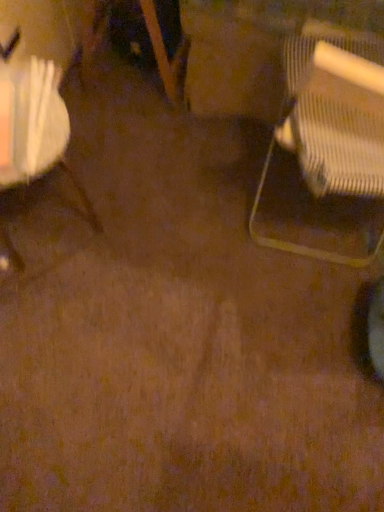
Question: Is white fabric bag at left, which is the first chair in left-to-right order, bigger or smaller than metallic mesh chair at right, arranged as the first chair when viewed from the right?

Choices:
 (A) big
 (B) small

Answer: (B)

Question: Considering the positions of white fabric bag at left, the second chair positioned from the right, and metallic mesh chair at right, placed as the second chair when sorted from left to right, in the image, is white fabric bag at left, the second chair positioned from the right, wider or thinner than metallic mesh chair at right, placed as the second chair when sorted from left to right,?

Choices:
 (A) wide
 (B) thin

Answer: (B)

Question: From a real-world perspective, is white fabric bag at left, the second chair positioned from the right, positioned above or below metallic mesh chair at right, arranged as the first chair when viewed from the right?

Choices:
 (A) below
 (B) above

Answer: (A)

Question: From their relative heights in the image, would you say metallic mesh chair at right, arranged as the first chair when viewed from the right, is taller or shorter than white fabric bag at left, which is the first chair in left-to-right order?

Choices:
 (A) tall
 (B) short

Answer: (A)

Question: Does point (352, 120) appear closer or farther from the camera than point (49, 135)?

Choices:
 (A) farther
 (B) closer

Answer: (A)

Question: From the image's perspective, is metallic mesh chair at right, arranged as the first chair when viewed from the right, positioned above or below white fabric bag at left, the second chair positioned from the right?

Choices:
 (A) above
 (B) below

Answer: (A)

Question: From a real-world perspective, relative to white fabric bag at left, the second chair positioned from the right, is metallic mesh chair at right, arranged as the first chair when viewed from the right, vertically above or below?

Choices:
 (A) below
 (B) above

Answer: (B)